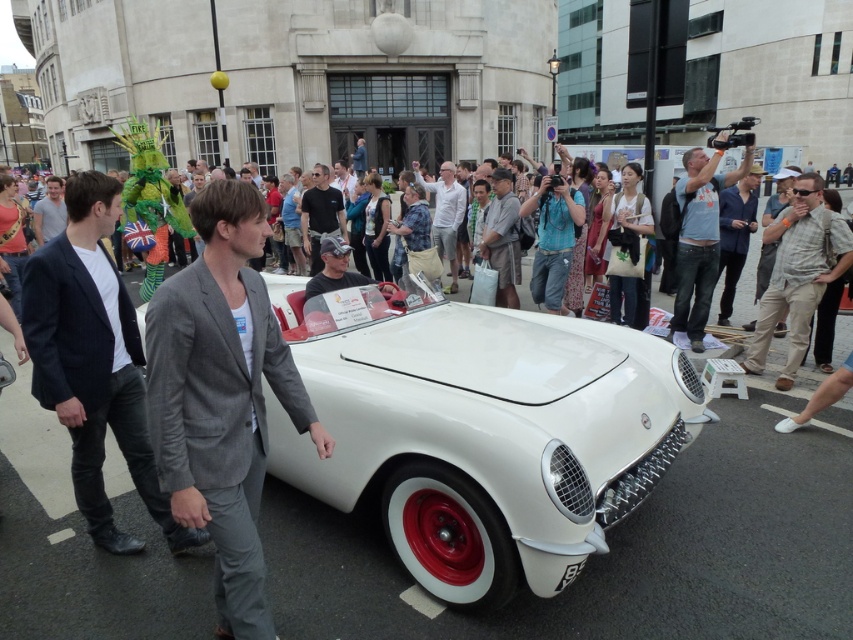
Question: Which object appears farthest from the camera in this image?

Choices:
 (A) gray cotton shirt at center
 (B) white fabric shirt at center
 (C) black matte shirt at center
 (D) gray wool blazer at center

Answer: (B)

Question: Which point is farther to the camera?

Choices:
 (A) (207, 513)
 (B) (314, 259)
 (C) (796, 307)

Answer: (B)

Question: Does khaki cotton pants at center have a lesser width compared to white fabric shirt at center?

Choices:
 (A) yes
 (B) no

Answer: (B)

Question: Does gray cotton shirt at center have a larger size compared to white fabric shirt at center?

Choices:
 (A) yes
 (B) no

Answer: (B)

Question: Which object appears closest to the camera in this image?

Choices:
 (A) white matte car at center
 (B) gray cotton shirt at center

Answer: (A)

Question: Is khaki cotton pants at center to the right of white fabric shirt at center from the viewer's perspective?

Choices:
 (A) no
 (B) yes

Answer: (B)